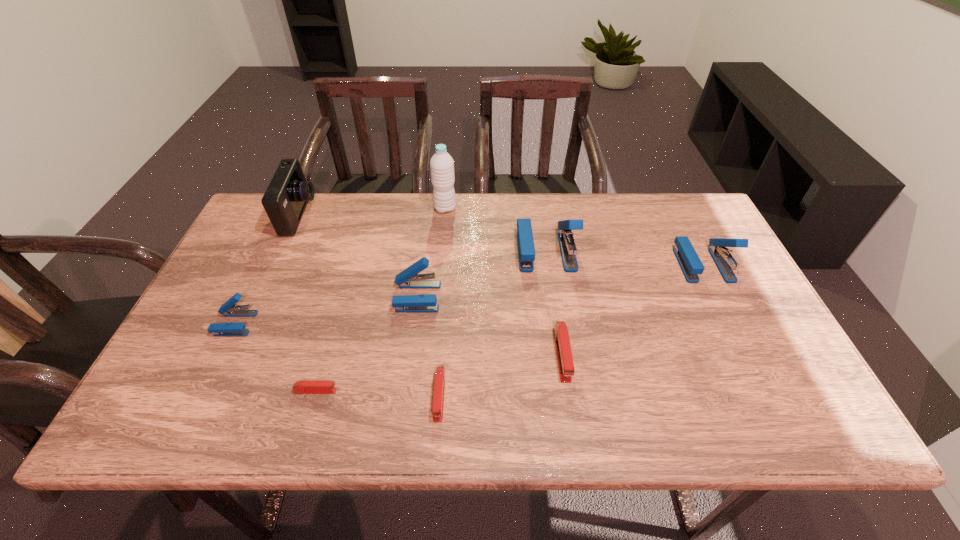
Where is `stapler that is at the left edge`? The height and width of the screenshot is (540, 960). stapler that is at the left edge is located at coordinates (228, 309).

What are the coordinates of `object that is positioned at the right edge` in the screenshot? It's located at (689, 261).

This screenshot has width=960, height=540. I want to click on object that is positioned at the far left corner, so click(285, 199).

In the image, there is a desktop. Identify the location of vacant area at the far edge. This screenshot has height=540, width=960. (336, 210).

Find the location of a particular element. The height and width of the screenshot is (540, 960). vacant space at the near edge of the desktop is located at coordinates (397, 429).

In the image, there is a desktop. Where is `vacant space at the left edge`? vacant space at the left edge is located at coordinates (223, 300).

In the image, there is a desktop. Where is `vacant space at the right edge`? vacant space at the right edge is located at coordinates (751, 316).

At what (x,y) coordinates should I click in order to perform the action: click on free area in between the white water bottle and the third shortest stapler. Please return your answer as a coordinate pair (x, y). This screenshot has width=960, height=540. Looking at the image, I should click on (504, 281).

Where is `empty space between the fourth shortest stapler and the shortest stapler`? The image size is (960, 540). empty space between the fourth shortest stapler and the shortest stapler is located at coordinates (276, 357).

The width and height of the screenshot is (960, 540). What are the coordinates of `free space between the third stapler from left to right and the second biggest blue stapler` in the screenshot? It's located at (560, 280).